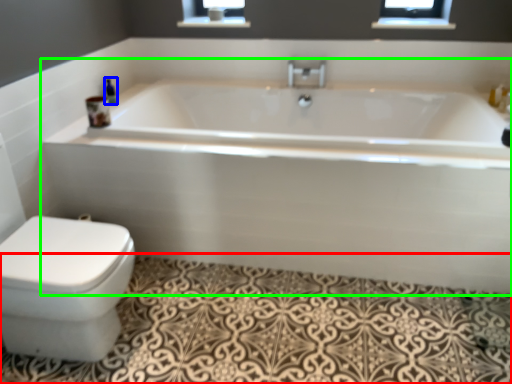
Question: Which object is positioned closest to bath mat (highlighted by a red box)? Select from toiletry (highlighted by a blue box) and bathtub (highlighted by a green box).

Choices:
 (A) toiletry
 (B) bathtub

Answer: (B)